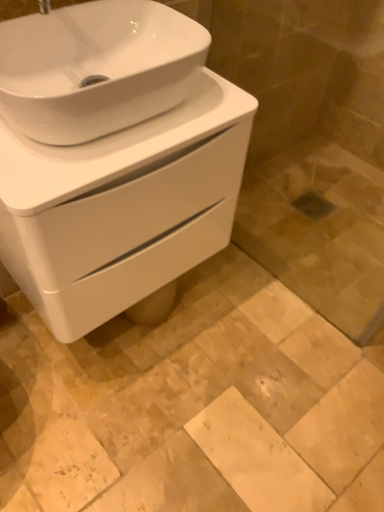
Question: From the image's perspective, is white glossy sink at center under beige marble tile at center?

Choices:
 (A) no
 (B) yes

Answer: (A)

Question: Is white glossy sink at center positioned with its back to beige marble tile at center?

Choices:
 (A) no
 (B) yes

Answer: (A)

Question: Is white glossy sink at center wider than beige marble tile at center?

Choices:
 (A) yes
 (B) no

Answer: (B)

Question: Does white glossy sink at center have a lesser height compared to beige marble tile at center?

Choices:
 (A) no
 (B) yes

Answer: (A)

Question: Does white glossy sink at center come behind beige marble tile at center?

Choices:
 (A) yes
 (B) no

Answer: (B)

Question: Would you say beige marble tile at center is part of white glossy sink at center's contents?

Choices:
 (A) yes
 (B) no

Answer: (B)

Question: From a real-world perspective, is transparent glass door at lower right over white glossy sink at center?

Choices:
 (A) no
 (B) yes

Answer: (A)

Question: Does transparent glass door at lower right have a lesser width compared to white glossy sink at center?

Choices:
 (A) yes
 (B) no

Answer: (A)

Question: Is white glossy sink at center inside transparent glass door at lower right?

Choices:
 (A) yes
 (B) no

Answer: (B)

Question: From a real-world perspective, does transparent glass door at lower right sit lower than white glossy sink at center?

Choices:
 (A) yes
 (B) no

Answer: (A)

Question: Is transparent glass door at lower right facing towards white glossy sink at center?

Choices:
 (A) no
 (B) yes

Answer: (B)

Question: Considering the relative sizes of transparent glass door at lower right and white glossy sink at center in the image provided, is transparent glass door at lower right shorter than white glossy sink at center?

Choices:
 (A) yes
 (B) no

Answer: (B)

Question: From a real-world perspective, is beige marble tile at center located higher than white glossy sink at center?

Choices:
 (A) no
 (B) yes

Answer: (A)